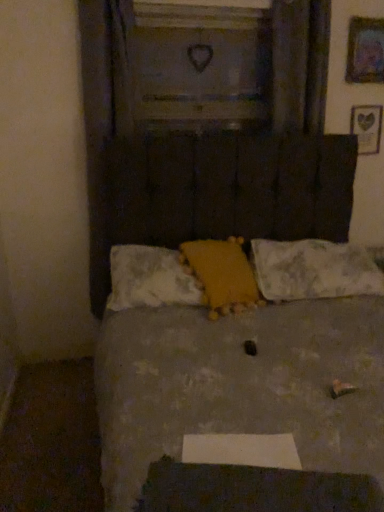
Question: Is yellow plush at center, which ranks as the 2th pillow in right-to-left order, to the left or to the right of wooden heart at upper right, positioned as the second picture frame in top-to-bottom order, in the image?

Choices:
 (A) left
 (B) right

Answer: (A)

Question: Would you say yellow plush at center, acting as the second pillow starting from the left, is inside or outside wooden heart at upper right, the 2th picture frame from the front?

Choices:
 (A) inside
 (B) outside

Answer: (B)

Question: Which is farther from the yellow plush at center, which ranks as the 2th pillow in right-to-left order?

Choices:
 (A) white textured pillow at center, which is the 1th pillow from right to left
 (B) wooden picture frame at upper right, which is counted as the 1th picture frame, starting from the front
 (C) yellow fabric pillow at center, which is counted as the first pillow, starting from the left
 (D) textured gray bed at center
 (E) wooden heart at upper right, the 1th picture frame in the bottom-to-top sequence

Answer: (B)

Question: Estimate the real-world distances between objects in this image. Which object is farther from the textured gray bed at center?

Choices:
 (A) yellow fabric pillow at center, which is counted as the first pillow, starting from the left
 (B) wooden picture frame at upper right, acting as the 1th picture frame starting from the top
 (C) white textured pillow at center, which is the 1th pillow from right to left
 (D) yellow plush at center, which ranks as the 2th pillow in right-to-left order
 (E) wooden heart at upper right, the 1th picture frame in the back-to-front sequence

Answer: (B)